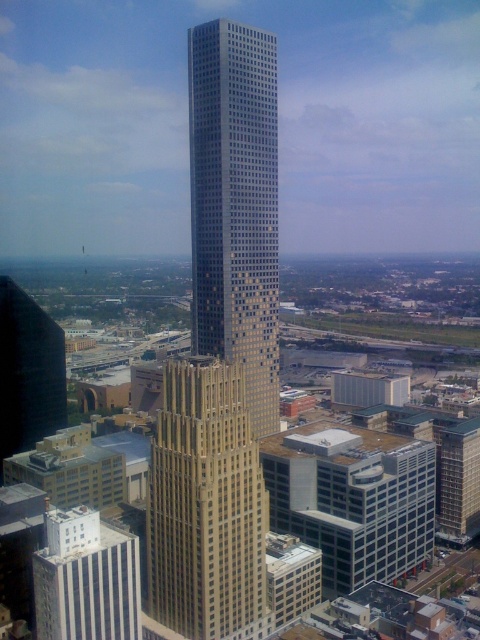
Question: Is smooth glass skyscraper at center above white concrete building at lower left?

Choices:
 (A) no
 (B) yes

Answer: (B)

Question: Can you confirm if smooth glass skyscraper at center is positioned to the right of white concrete building at lower left?

Choices:
 (A) no
 (B) yes

Answer: (B)

Question: Which object is the farthest from the white concrete building at lower left?

Choices:
 (A) beige stone skyscraper at center
 (B) smooth glass skyscraper at center

Answer: (B)

Question: Which point is farther from the camera taking this photo?

Choices:
 (A) (226, 266)
 (B) (228, 524)

Answer: (A)

Question: Which of the following is the farthest from the observer?

Choices:
 (A) white concrete building at lower left
 (B) smooth glass skyscraper at center
 (C) beige stone skyscraper at center

Answer: (B)

Question: From the image, what is the correct spatial relationship of smooth glass skyscraper at center in relation to beige stone skyscraper at center?

Choices:
 (A) below
 (B) above

Answer: (B)